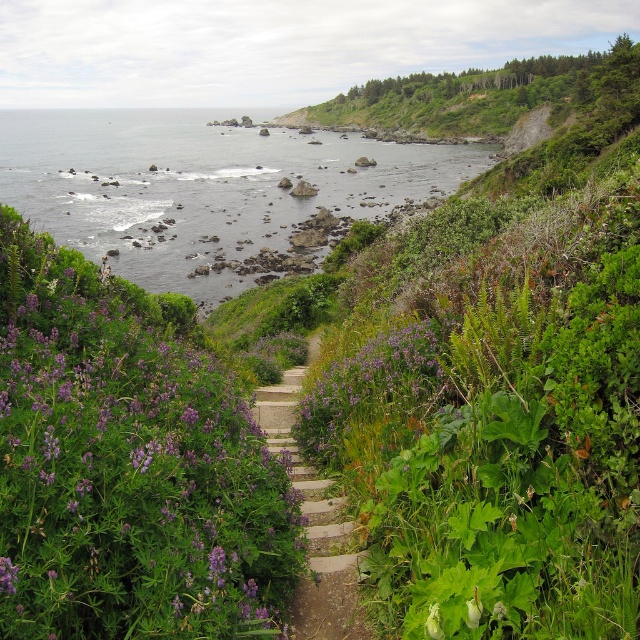
You are standing at the starting point of the stone path in the coastal landscape. You notice a point marked at coordinates (x=131, y=476). What type of flowers are located at that point?

The point at coordinates (x=131, y=476) marks purple soft textured flowers at center left.